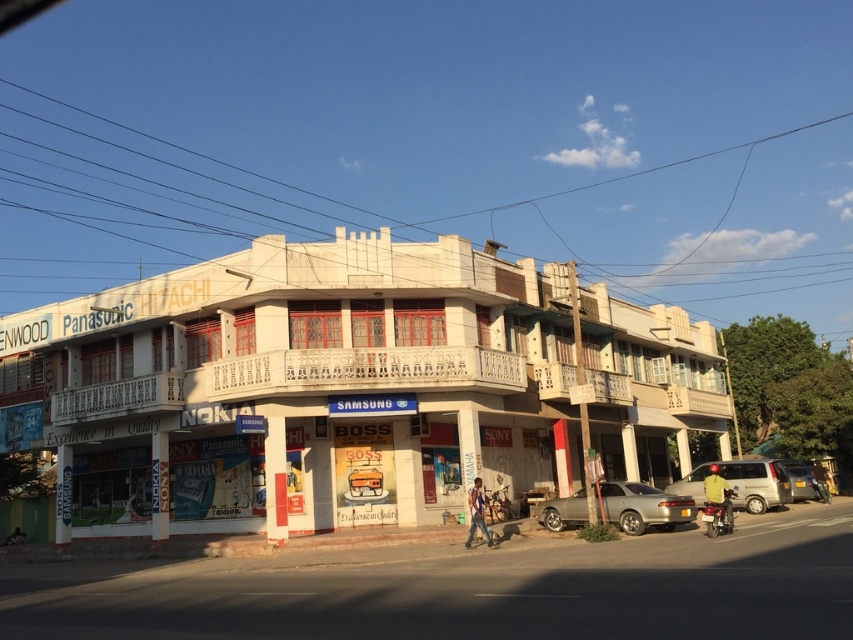
Which is behind, point (83, 108) or point (712, 508)?

Point (83, 108)

Is point (454, 218) in front of point (712, 531)?

No, it is not.

Who is more distant from viewer, (437, 220) or (724, 493)?

Point (437, 220)

Where is `black wire at upper center`? The width and height of the screenshot is (853, 640). black wire at upper center is located at coordinates (445, 214).

Is point (73, 444) more distant than point (782, 497)?

No, it is not.

Which is behind, point (230, 449) or point (679, 486)?

The point (679, 486) is more distant.

Between point (548, 465) and point (693, 492), which one is positioned in front?

Point (693, 492)

At what (x,y) coordinates should I click in order to perform the action: click on white concrete building at center. Please return your answer as a coordinate pair (x, y). The width and height of the screenshot is (853, 640). Looking at the image, I should click on (343, 387).

Can you confirm if black wire at upper center is bigger than satin silver sedan at center?

Correct, black wire at upper center is larger in size than satin silver sedan at center.

Is black wire at upper center positioned in front of satin silver sedan at center?

→ No, it is behind satin silver sedan at center.

Does point (518, 202) lie behind point (668, 509)?

Yes, point (518, 202) is farther from viewer.

Identify the location of black wire at upper center. Image resolution: width=853 pixels, height=640 pixels. (445, 214).